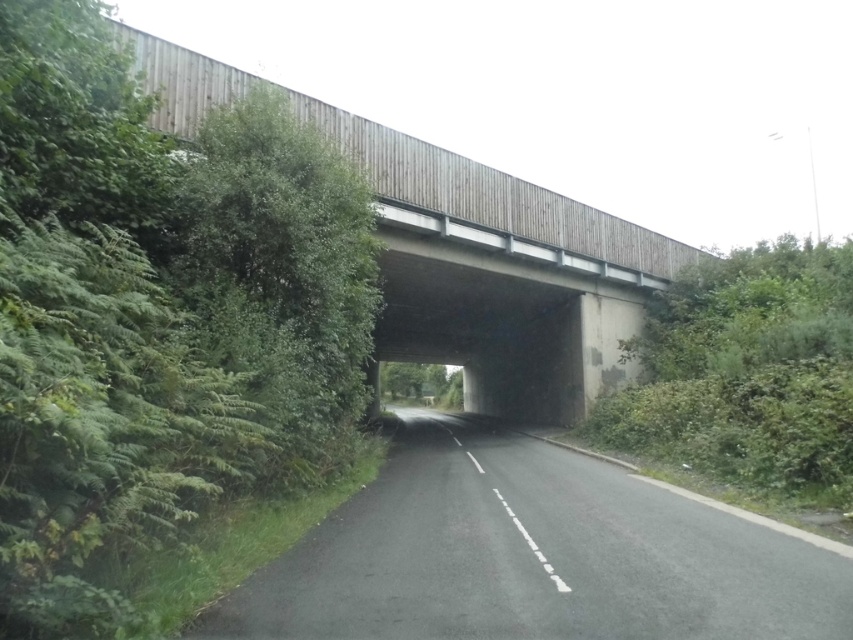
Does black asphalt road at center come behind wooden bridge at center?

That is False.

This screenshot has height=640, width=853. Describe the element at coordinates (532, 556) in the screenshot. I see `black asphalt road at center` at that location.

Locate an element on the screen. The image size is (853, 640). black asphalt road at center is located at coordinates (532, 556).